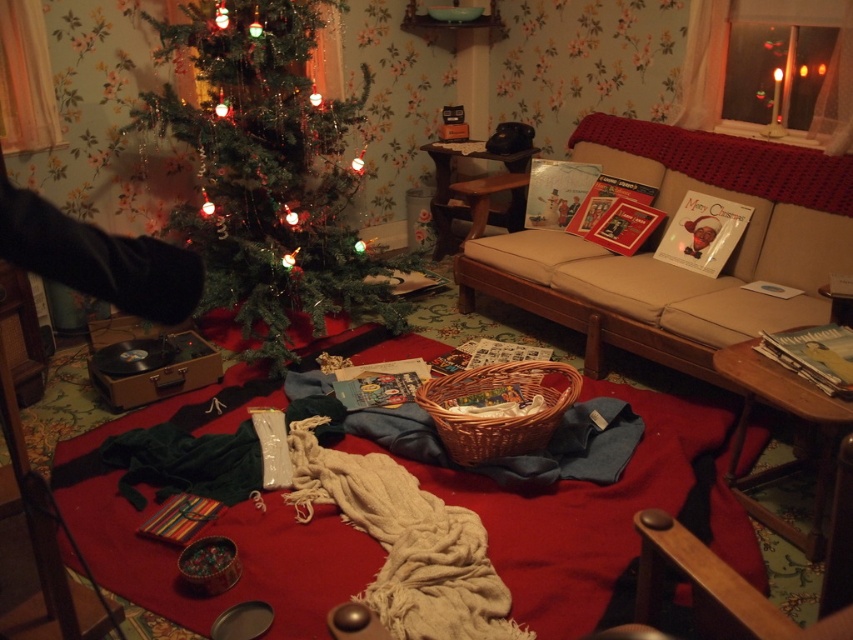
Question: Estimate the real-world distances between objects in this image. Which object is farther from the beige fabric couch at center?

Choices:
 (A) green matte christmas tree at center
 (B) woven brown basket at center

Answer: (A)

Question: Can you confirm if beige fabric couch at center is wider than woven brown basket at center?

Choices:
 (A) no
 (B) yes

Answer: (B)

Question: Does green matte christmas tree at center have a smaller size compared to beige fabric couch at center?

Choices:
 (A) no
 (B) yes

Answer: (A)

Question: Which object appears closest to the camera in this image?

Choices:
 (A) beige fabric couch at center
 (B) green matte christmas tree at center

Answer: (A)

Question: Which object is positioned farthest from the green matte christmas tree at center?

Choices:
 (A) woven brown basket at center
 (B) beige fabric couch at center

Answer: (A)

Question: Does green matte christmas tree at center appear over beige fabric couch at center?

Choices:
 (A) no
 (B) yes

Answer: (B)